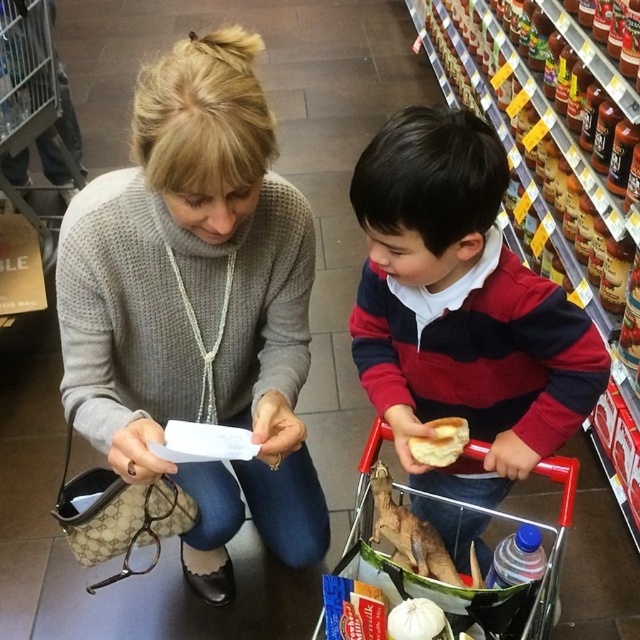
You are standing at the entrance of the grocery store and want to reach the metallic silver trolley at lower center. According to the coordinates provided, what direction should you move relative to your current position?

The metallic silver trolley at lower center is located at coordinates point (35, 108). Since coordinates typically represent positions on a grid where lower values indicate left or downward directions, you should move towards the lower left direction from your current position at the entrance to reach it.